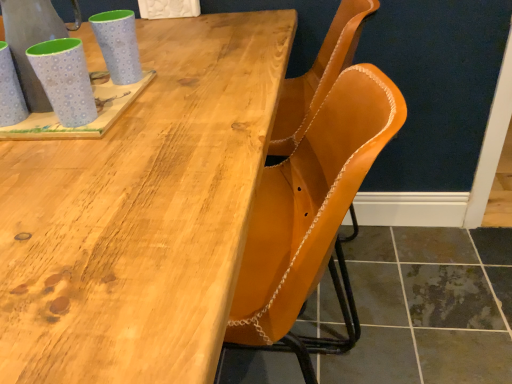
At what (x,y) coordinates should I click in order to perform the action: click on vacant area in front of matte blue mug at upper left, the 2th mug positioned from the right. Please return your answer as a coordinate pair (x, y). The height and width of the screenshot is (384, 512). Looking at the image, I should click on (59, 174).